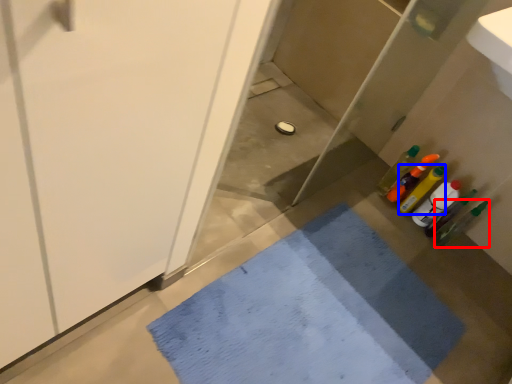
Question: Among these objects, which one is nearest to the camera, bottle (highlighted by a red box) or bottle (highlighted by a blue box)?

Choices:
 (A) bottle
 (B) bottle

Answer: (A)